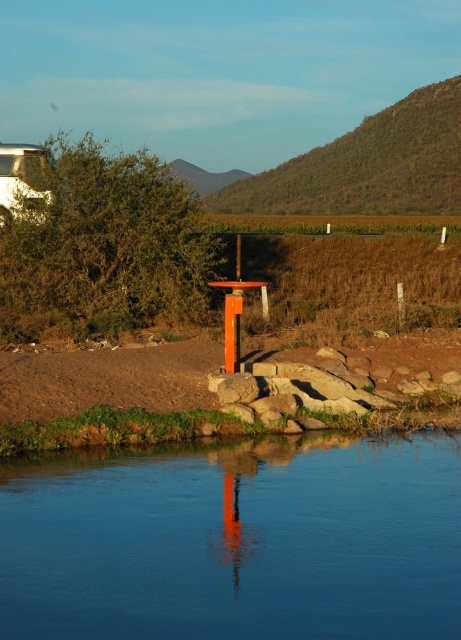
You are standing at the edge of the transparent glass river at center and want to reach the green leafy hillside at upper center. Which direction should you walk to get there?

You should walk to the right because the transparent glass river at center is to the left of the green leafy hillside at upper center, so moving right would lead you towards the hillside.

You are standing on the green leafy hillside at upper center and want to get to the transparent glass river at center. Which direction should you walk to reach it?

You should walk downward towards the transparent glass river at center since it is located below the green leafy hillside at upper center.